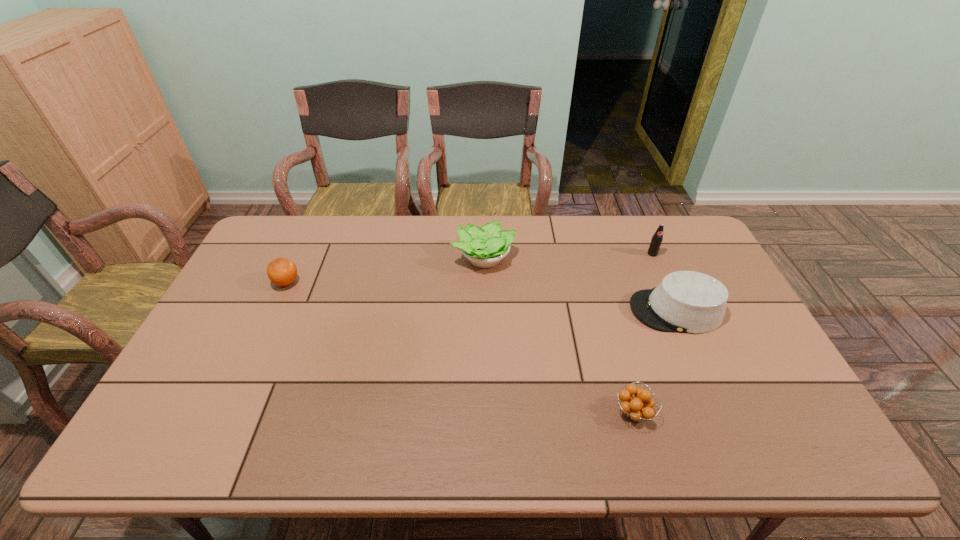
You are a GUI agent. You are given a task and a screenshot of the screen. Output one action in this format:
    pyautogui.click(x=<x>, y=<y>)
    Task: Click on the free space at the near edge
    The image size is (960, 540).
    Given the screenshot: What is the action you would take?
    pyautogui.click(x=363, y=453)

Find the location of a particular element. free space at the left edge of the desktop is located at coordinates (x=268, y=259).

Find the location of a particular element. The image size is (960, 540). free location at the right edge of the desktop is located at coordinates (747, 359).

This screenshot has height=540, width=960. I want to click on blank area at the near left corner, so pyautogui.click(x=211, y=425).

At what (x,y) coordinates should I click in order to perform the action: click on vacant space at the far right corner. Please return your answer as a coordinate pair (x, y). Image resolution: width=960 pixels, height=540 pixels. Looking at the image, I should click on (690, 227).

The image size is (960, 540). I want to click on free space between the shortest object and the farther orange fruit, so click(x=460, y=347).

Identify the location of empty space between the third object from right to left and the leftmost object. This screenshot has width=960, height=540. (460, 347).

The image size is (960, 540). In order to click on vacant area that lies between the tallest object and the second object from left to right in this screenshot , I will do pos(568,256).

Locate an element on the screen. This screenshot has height=540, width=960. free space between the tallest object and the fourth object from right to left is located at coordinates (568, 256).

Identify the location of vacant space in between the hat and the lettuce. This screenshot has width=960, height=540. pos(580,284).